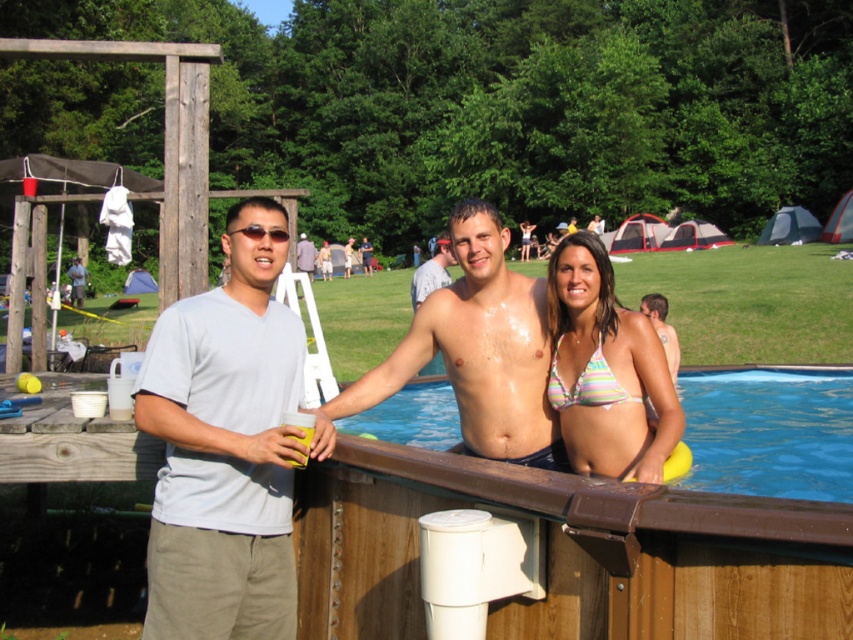
You are a photographer at the campsite. You need to capture a photo of the shiny skin at center and the blue wooden swimming pool at center. Which object is positioned higher in the image?

The shiny skin at center is located above the blue wooden swimming pool at center, so it is positioned higher in the image.

Based on the photo, you are standing at the edge of the blue wooden swimming pool at center and want to move towards the smooth skin torso at center. In which direction should you walk?

You should walk to the left because the blue wooden swimming pool at center is to the right of the smooth skin torso at center, so moving left will take you towards the torso.